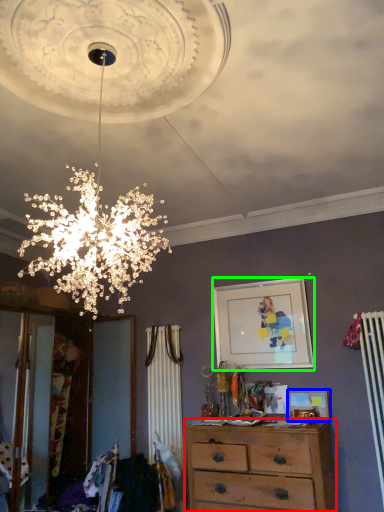
Question: Estimate the real-world distances between objects in this image. Which object is farther from chest of drawers (highlighted by a red box), picture frame (highlighted by a blue box) or picture frame (highlighted by a green box)?

Choices:
 (A) picture frame
 (B) picture frame

Answer: (B)